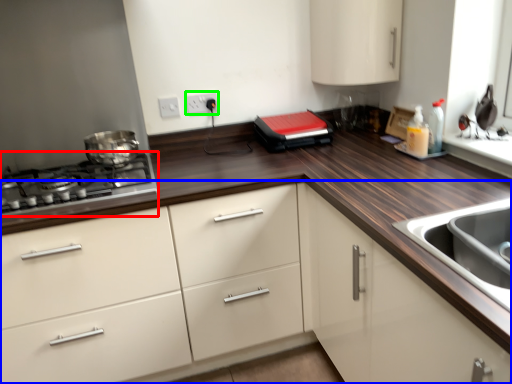
Question: Which object is the farthest from gas stove (highlighted by a red box)? Choose among these: cabinetry (highlighted by a blue box) or electric outlet (highlighted by a green box).

Choices:
 (A) cabinetry
 (B) electric outlet

Answer: (B)